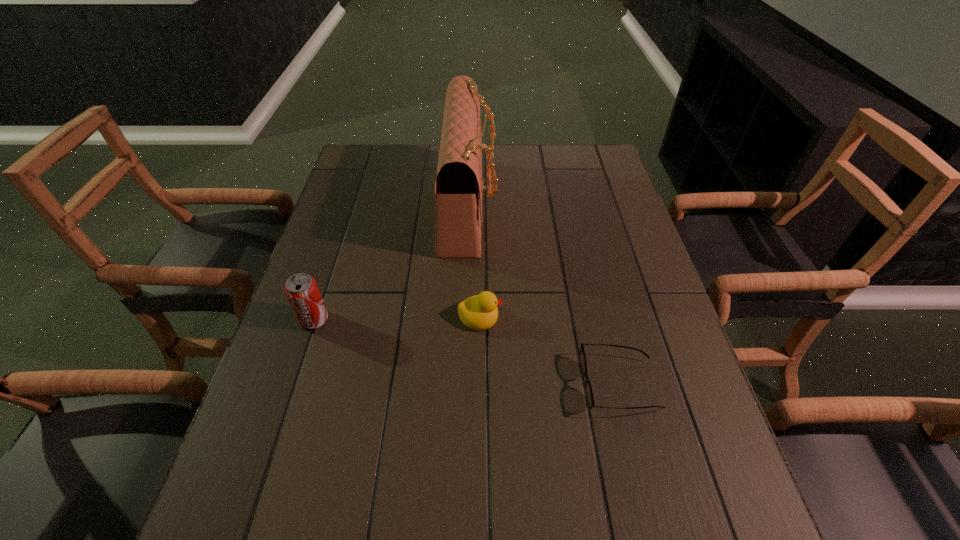
Identify which object is the second nearest to the rightmost object. Please provide its 2D coordinates. Your answer should be formatted as a tuple, i.e. [(x, y)], where the tuple contains the x and y coordinates of a point satisfying the conditions above.

[(459, 188)]

Find the location of `object that stands as the second closest to the rightmost object`. object that stands as the second closest to the rightmost object is located at coordinates (459, 188).

Where is `free space that satisfies the following two spatial constraints: 1. on the front-facing side of the tallest object; 2. on the front side of the leftmost object`? The width and height of the screenshot is (960, 540). free space that satisfies the following two spatial constraints: 1. on the front-facing side of the tallest object; 2. on the front side of the leftmost object is located at coordinates (465, 320).

In order to click on vacant position in the image that satisfies the following two spatial constraints: 1. on the face of the third tallest object; 2. on the front side of the third shortest object in this screenshot , I will do `click(480, 320)`.